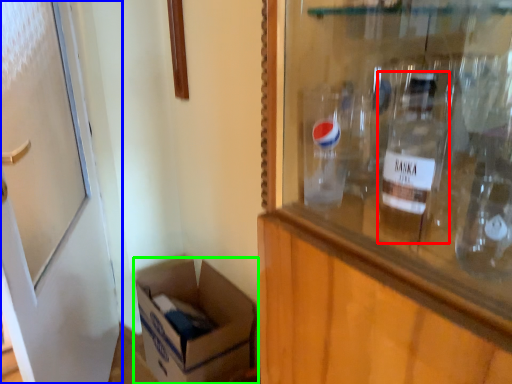
Question: Based on their relative distances, which object is nearer to bottle (highlighted by a red box)? Choose from door (highlighted by a blue box) and box (highlighted by a green box).

Choices:
 (A) door
 (B) box

Answer: (A)